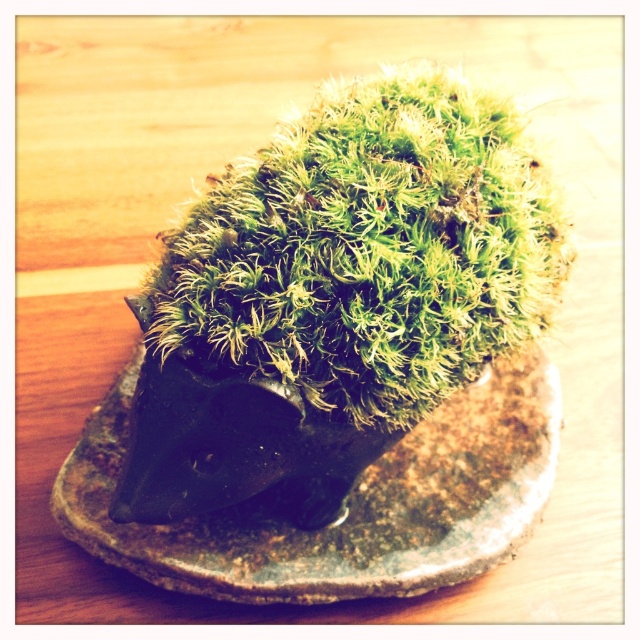
Question: Is green mossy hedgehog at center below green mossy stone at center?

Choices:
 (A) yes
 (B) no

Answer: (B)

Question: Is green mossy hedgehog at center behind green mossy stone at center?

Choices:
 (A) yes
 (B) no

Answer: (B)

Question: Which of the following is the farthest from the observer?

Choices:
 (A) (522, 477)
 (B) (316, 227)

Answer: (A)

Question: Is green mossy hedgehog at center further to camera compared to green mossy stone at center?

Choices:
 (A) no
 (B) yes

Answer: (A)

Question: Which object appears closest to the camera in this image?

Choices:
 (A) green mossy hedgehog at center
 (B) green mossy stone at center

Answer: (A)